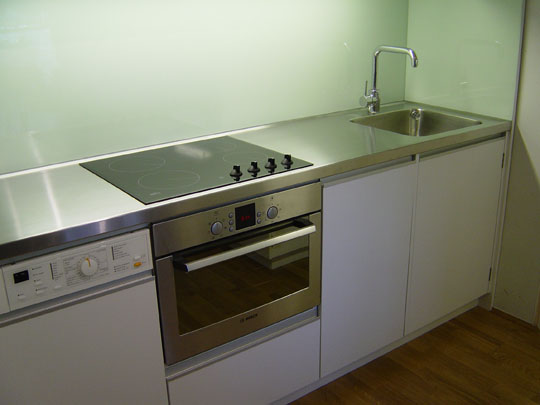
You are a GUI agent. You are given a task and a screenshot of the screen. Output one action in this format:
    pyautogui.click(x=<x>, y=<y>)
    Task: Click on the floor
    The image size is (540, 405).
    Given the screenshot: What is the action you would take?
    pyautogui.click(x=463, y=366)